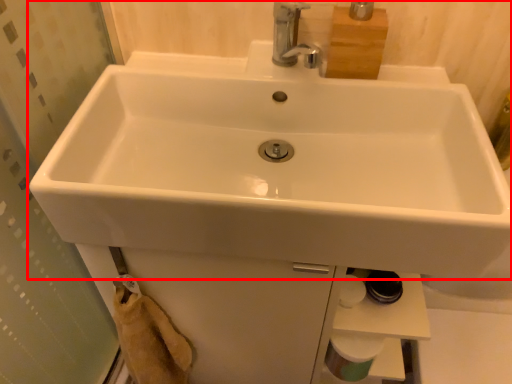
Question: Observing the image, what is the correct spatial positioning of sink (annotated by the red box) in reference to toilet paper?

Choices:
 (A) left
 (B) right

Answer: (A)